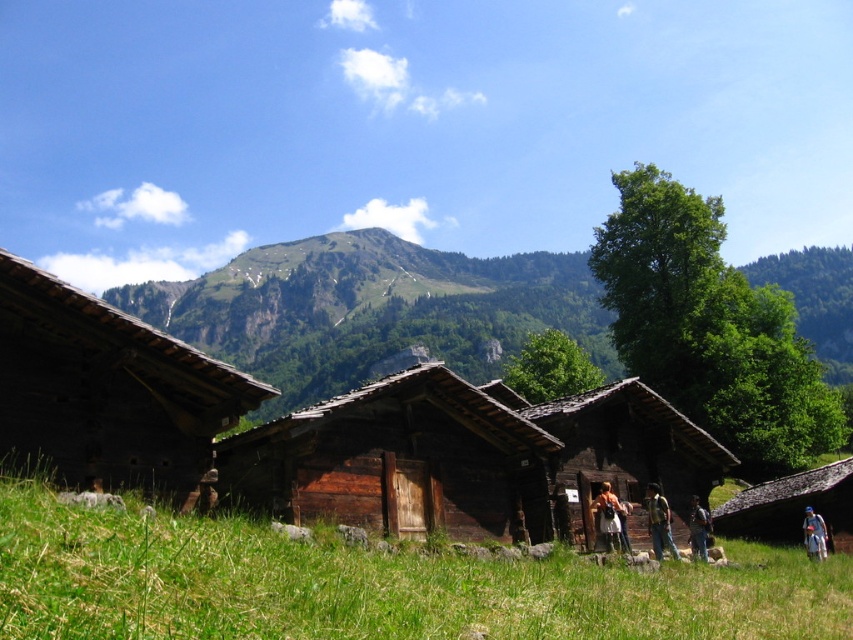
Based on the photo, you are standing at point 0.5, 0.5 in this image. Which direction should you walk to reach the brown wooden hut at center?

Since the brown wooden hut at center is located at point (462, 456), you should walk northeast to reach it from your current position at (426, 320).

You are standing at the origin point in the image. You want to walk to the green grassy at lower center. What direction should you move in to reach it?

Since the green grassy at lower center is located at point 0.914 on the x axis and 0.438 on the y axis, you should move right and slightly up to reach it.